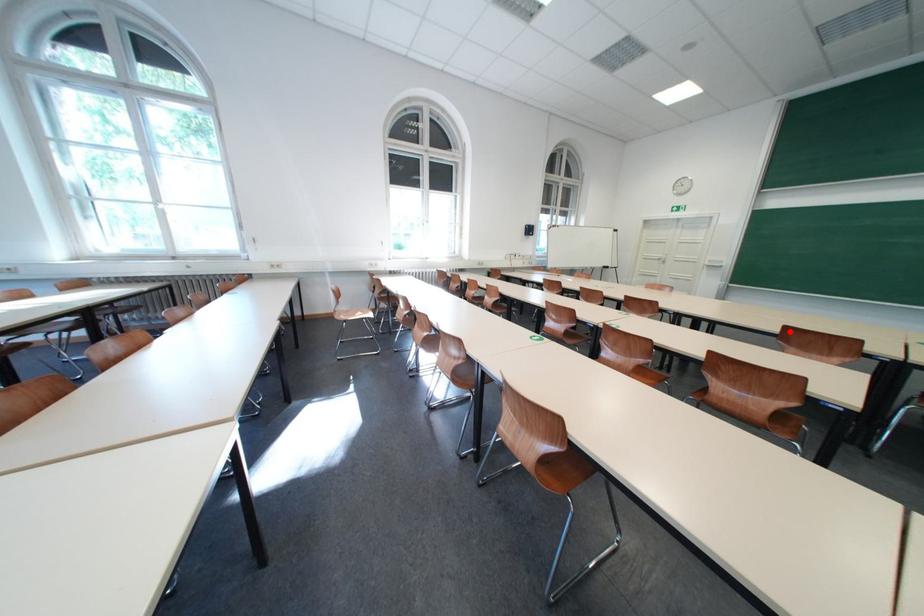
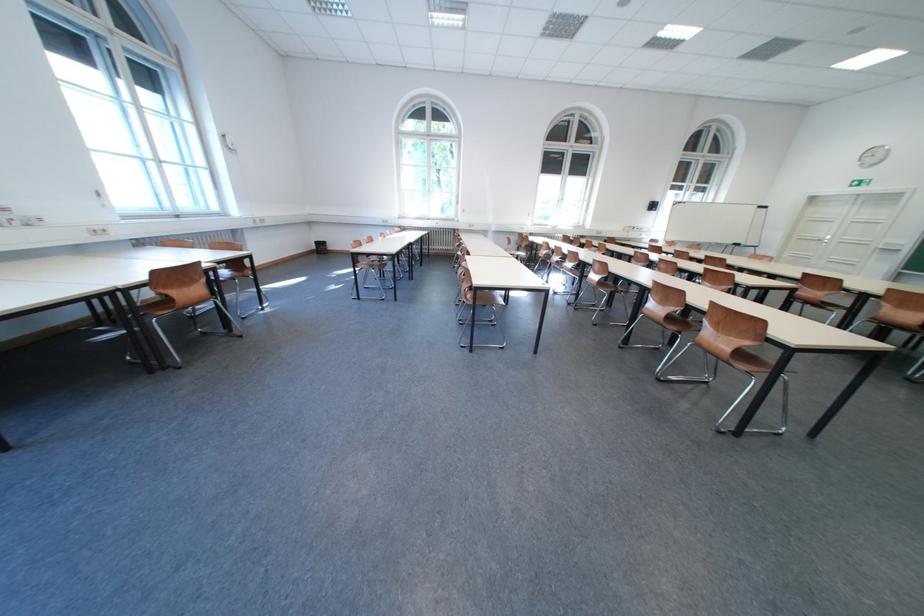
Question: A red point is marked in image1. In image2, is the corresponding 3D point closer to the camera or farther? Reply with the corresponding letter.

Choices:
 (A) The corresponding 3D point is closer.
 (B) The corresponding 3D point is farther.

Answer: (A)